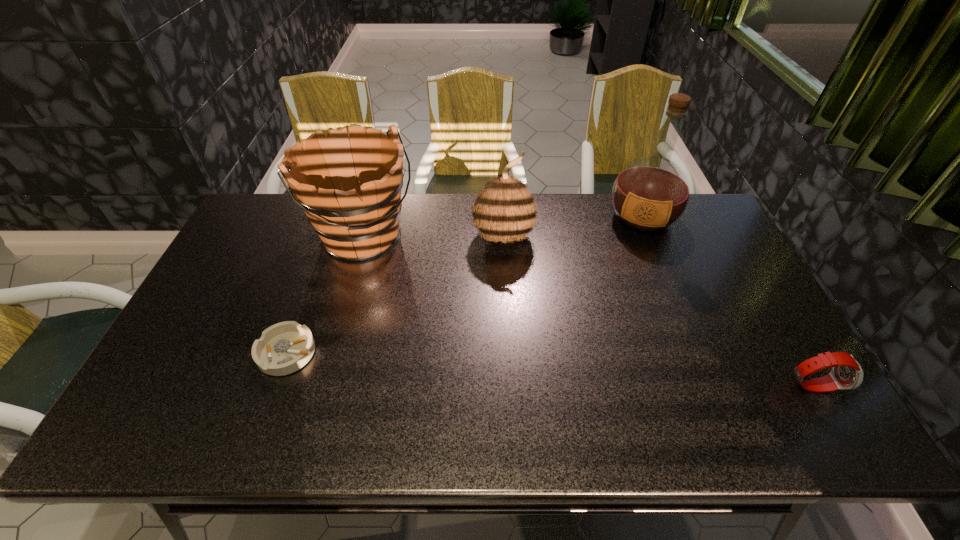
Locate an element on the screen. free space on the desktop that is between the ashtray and the second shortest object and is positioned on the surface of the third object from left to right is located at coordinates (596, 372).

I want to click on vacant spot on the desktop that is between the shortest object and the rightmost object and is positioned on the front label of the second object from right to left, so click(610, 373).

Identify the location of free space on the desktop that is between the ashtray and the second shortest object and is positioned with the handle on the wine bucket. (475, 364).